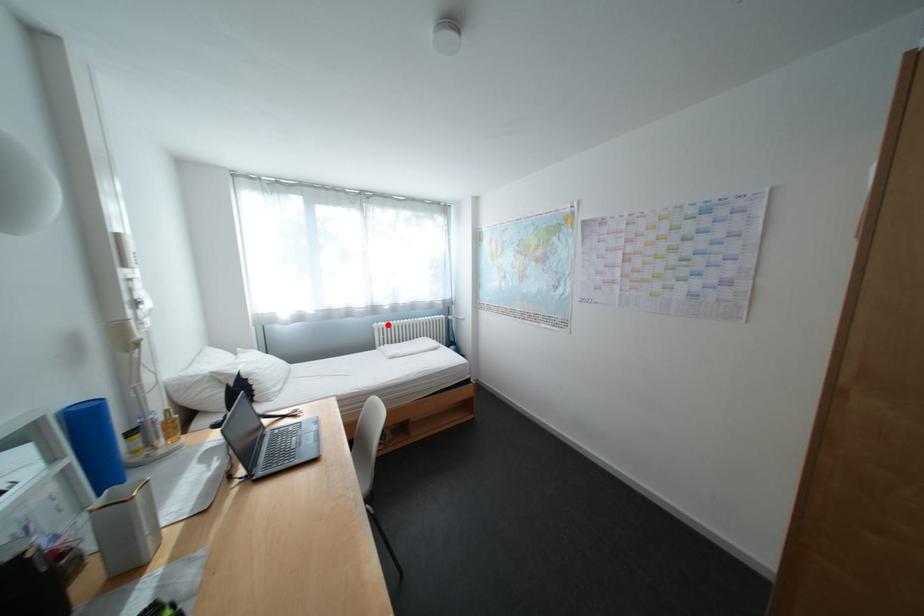
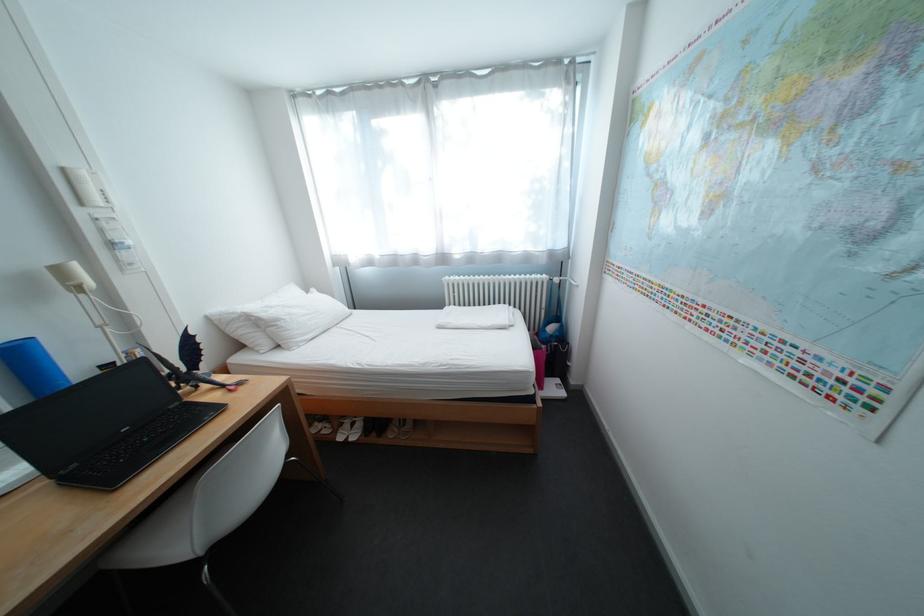
In the second image, find the point that corresponds to the highlighted location in the first image.

(459, 278)